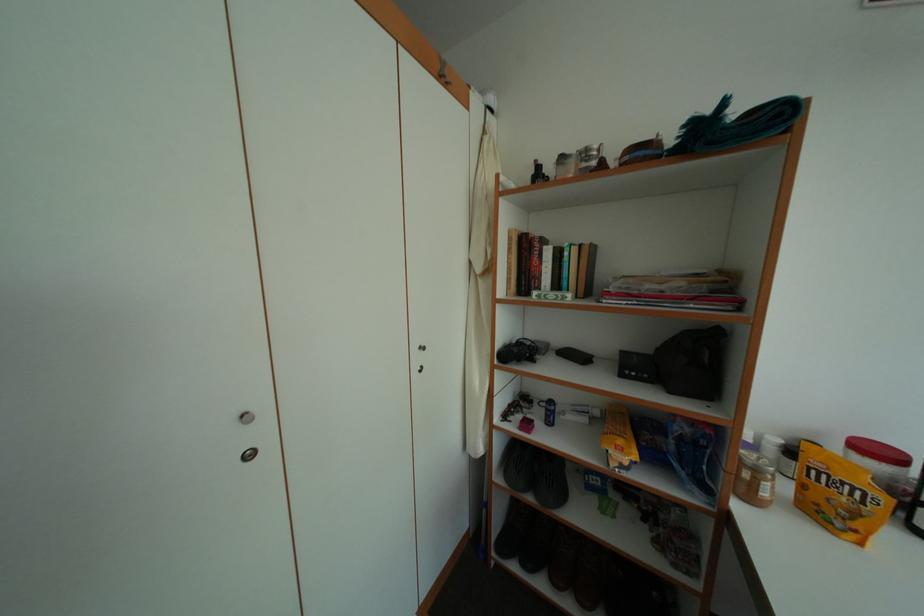
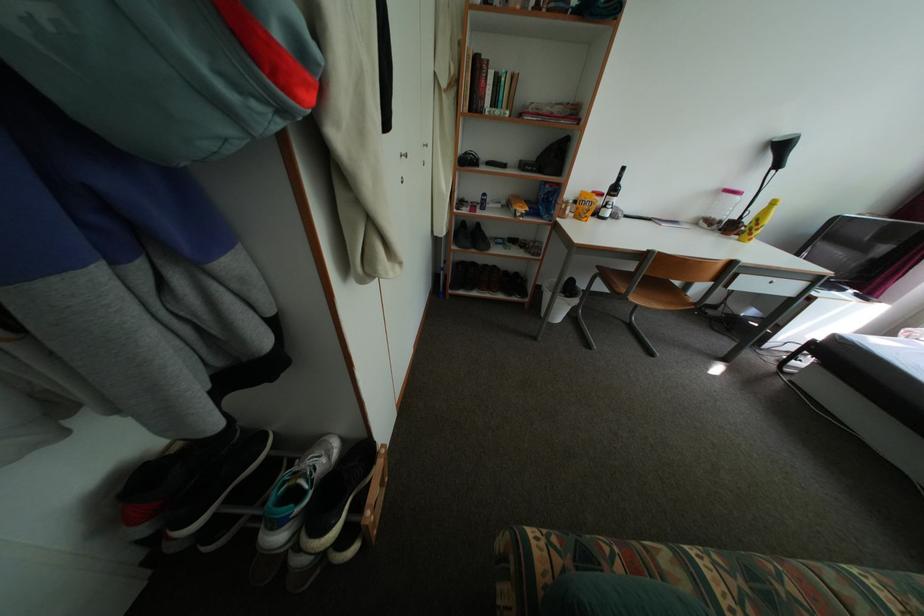
From the picture: The images are taken continuously from a first-person perspective. In which direction is your viewpoint rotating?

The camera rotated toward right-down.